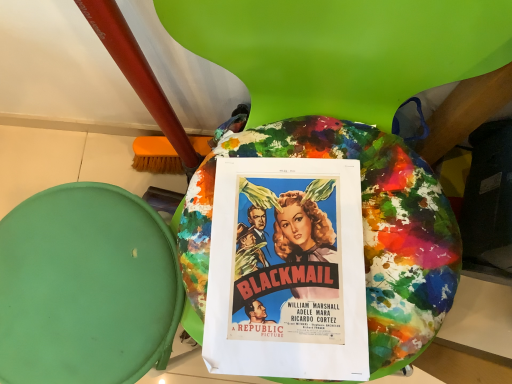
Question: In terms of size, does matte paper poster at center appear bigger or smaller than green fabric bean bag at lower left?

Choices:
 (A) small
 (B) big

Answer: (A)

Question: In terms of width, does matte paper poster at center look wider or thinner when compared to green fabric bean bag at lower left?

Choices:
 (A) wide
 (B) thin

Answer: (B)

Question: Visually, is matte paper poster at center positioned to the left or to the right of green fabric bean bag at lower left?

Choices:
 (A) left
 (B) right

Answer: (B)

Question: Is green fabric bean bag at lower left in front of or behind matte paper poster at center in the image?

Choices:
 (A) behind
 (B) front

Answer: (A)

Question: Based on their sizes in the image, would you say green fabric bean bag at lower left is bigger or smaller than matte paper poster at center?

Choices:
 (A) big
 (B) small

Answer: (A)

Question: From a real-world perspective, is green fabric bean bag at lower left physically located above or below matte paper poster at center?

Choices:
 (A) below
 (B) above

Answer: (A)

Question: Based on their positions, is green fabric bean bag at lower left located to the left or right of matte paper poster at center?

Choices:
 (A) left
 (B) right

Answer: (A)